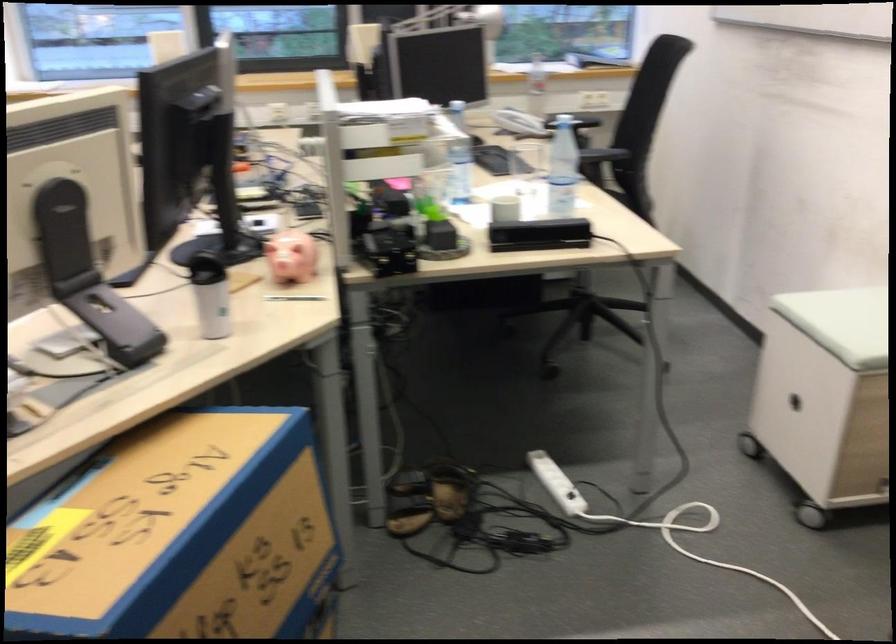
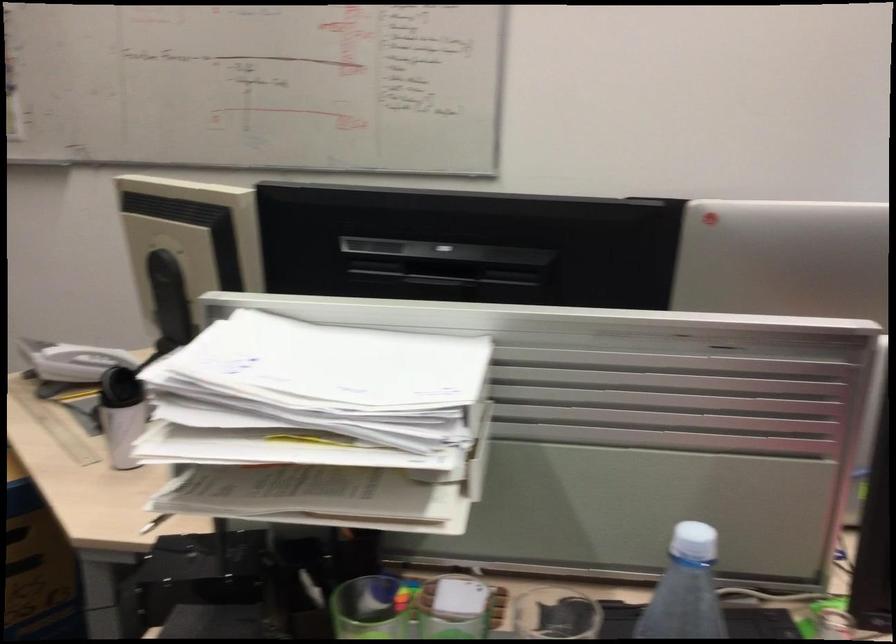
In the second image, find the point that corresponds to point 366,109 in the first image.

(333, 365)